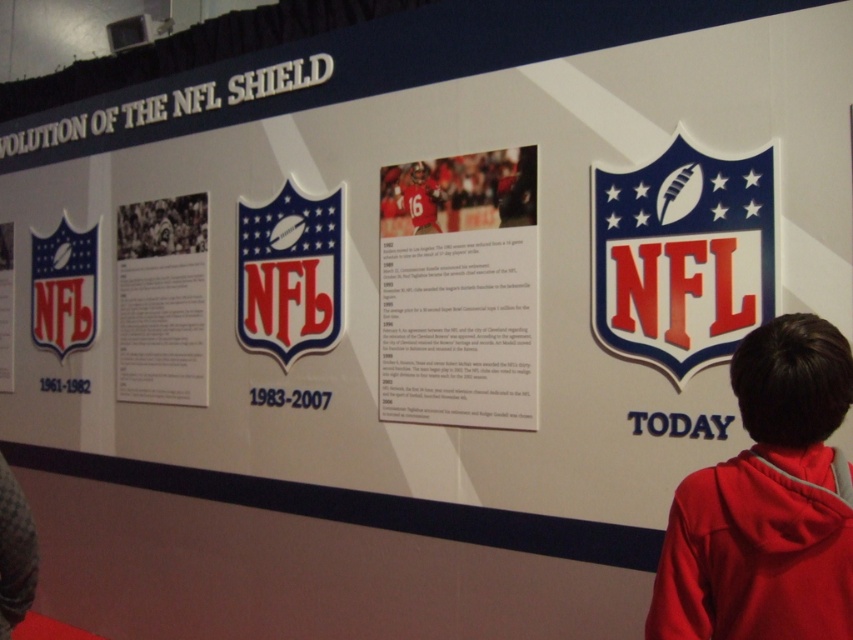
You are standing in front of the NFL Shield evolution display. You see two points marked on the display. The first point is at coordinates point (195,212) and the second is at point (425,189). Which point is closer to you?

Point (195,212) is further to the camera than point (425,189). Therefore, point (425,189) is closer to you.

You are an exhibit designer who needs to ensure visitors can comfortably view both the black paper at center and the matte jersey at center from a distance. The recommended viewing distance for the black paper is 1.5 meters. Is the current spacing between them sufficient for visitors to comfortably view both items without moving closer than the recommended distance?

The black paper at center is 1.37 meters from the matte jersey at center. Since the recommended viewing distance for the black paper is 1.5 meters, the current spacing of 1.37 meters is slightly less than the recommended distance. Visitors may need to move closer to view both items comfortably, so adjusting the spacing to at least 1.5 meters would be advisable.